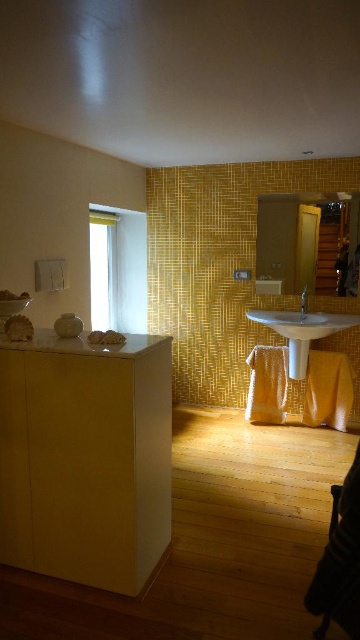
You are designing a layout for a bathroom and need to place a new plant stand that requires at least 1 meter of space. You have the wooden chair at lower right and the white sheer curtain at upper left in the scene. Which object can accommodate the plant stand based on their size?

The wooden chair at lower right has a larger size compared to the white sheer curtain at upper left, so the plant stand can be placed near the wooden chair at lower right as it likely provides enough space.

You are standing in the bathroom and want to open the window to let in some fresh air. The window is behind the white sheer curtain at upper left. To reach the window, you need to move the curtain. However, there is a satin nickel faucet at center in the way. Which object should you move first to access the window?

You should move the white sheer curtain at upper left first because it is located to the left of the satin nickel faucet at center, blocking access to the window.